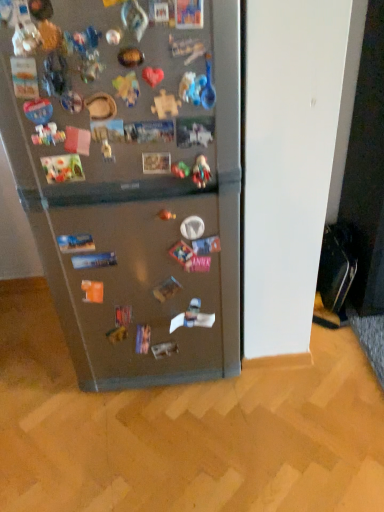
What do you see at coordinates (131, 179) in the screenshot? I see `satin metallic refrigerator at center` at bounding box center [131, 179].

At what (x,y) coordinates should I click in order to perform the action: click on satin metallic refrigerator at center. Please return your answer as a coordinate pair (x, y). Image resolution: width=384 pixels, height=512 pixels. Looking at the image, I should click on (131, 179).

The image size is (384, 512). What do you see at coordinates (201, 172) in the screenshot?
I see `plastic toy at center` at bounding box center [201, 172].

The image size is (384, 512). Find the location of `plastic toy at center`. plastic toy at center is located at coordinates (201, 172).

Find the location of `satin metallic refrigerator at center`. satin metallic refrigerator at center is located at coordinates (131, 179).

Which object is positioned more to the right, satin metallic refrigerator at center or plastic toy at center?

plastic toy at center is more to the right.

Considering the relative positions of satin metallic refrigerator at center and plastic toy at center in the image provided, is satin metallic refrigerator at center in front of plastic toy at center?

Yes, satin metallic refrigerator at center is in front of plastic toy at center.

Which is behind, point (65, 304) or point (209, 168)?

Point (65, 304)

From the image's perspective, is satin metallic refrigerator at center above or below plastic toy at center?

From the image's perspective, satin metallic refrigerator at center appears below plastic toy at center.

From a real-world perspective, is satin metallic refrigerator at center positioned under plastic toy at center based on gravity?

Indeed, from a real-world perspective, satin metallic refrigerator at center is positioned beneath plastic toy at center.

Considering the sizes of satin metallic refrigerator at center and plastic toy at center in the image, is satin metallic refrigerator at center wider or thinner than plastic toy at center?

In the image, satin metallic refrigerator at center appears to be wider than plastic toy at center.

In the scene shown: Considering the relative sizes of satin metallic refrigerator at center and plastic toy at center in the image provided, is satin metallic refrigerator at center shorter than plastic toy at center?

No, satin metallic refrigerator at center is not shorter than plastic toy at center.

Considering the sizes of satin metallic refrigerator at center and plastic toy at center in the image, is satin metallic refrigerator at center bigger or smaller than plastic toy at center?

Clearly, satin metallic refrigerator at center is larger in size than plastic toy at center.

Is satin metallic refrigerator at center positioned beyond the bounds of plastic toy at center?

Yes, satin metallic refrigerator at center is located beyond the bounds of plastic toy at center.

Is satin metallic refrigerator at center next to plastic toy at center and touching it?

They are not placed beside each other.

Could you tell me if satin metallic refrigerator at center is turned towards plastic toy at center?

Yes, satin metallic refrigerator at center is aimed at plastic toy at center.

Measure the distance between satin metallic refrigerator at center and plastic toy at center.

12.91 inches.

This screenshot has width=384, height=512. Find the location of `toy to the right of satin metallic refrigerator at center`. toy to the right of satin metallic refrigerator at center is located at coordinates (201, 172).

Between plastic toy at center and satin metallic refrigerator at center, which one appears on the right side from the viewer's perspective?

plastic toy at center.

Is plastic toy at center in front of or behind satin metallic refrigerator at center in the image?

In the image, plastic toy at center appears behind satin metallic refrigerator at center.

Is point (204, 172) positioned before point (76, 308)?

Yes, point (204, 172) is in front of point (76, 308).

From the image's perspective, is plastic toy at center above satin metallic refrigerator at center?

Yes, from the image's perspective, plastic toy at center is above satin metallic refrigerator at center.

From a real-world perspective, relative to satin metallic refrigerator at center, is plastic toy at center vertically above or below?

plastic toy at center is above satin metallic refrigerator at center.

Between plastic toy at center and satin metallic refrigerator at center, which one has smaller width?

plastic toy at center.

Which of these two, plastic toy at center or satin metallic refrigerator at center, stands shorter?

plastic toy at center is shorter.

Which of these two, plastic toy at center or satin metallic refrigerator at center, is bigger?

With larger size is satin metallic refrigerator at center.

Is satin metallic refrigerator at center completely or partially inside plastic toy at center?

No, satin metallic refrigerator at center is located outside of plastic toy at center.

Based on the photo, is plastic toy at center far away from satin metallic refrigerator at center?

No.

Is plastic toy at center positioned with its back to satin metallic refrigerator at center?

Absolutely, plastic toy at center is directed away from satin metallic refrigerator at center.

How many degrees apart are the facing directions of plastic toy at center and satin metallic refrigerator at center?

The angular difference between plastic toy at center and satin metallic refrigerator at center is 1.61 degrees.

Locate an element on the screen. The height and width of the screenshot is (512, 384). refrigerator that appears in front of the plastic toy at center is located at coordinates (131, 179).

Where is `refrigerator that appears below the plastic toy at center (from a real-world perspective)`? The width and height of the screenshot is (384, 512). refrigerator that appears below the plastic toy at center (from a real-world perspective) is located at coordinates (131, 179).

Image resolution: width=384 pixels, height=512 pixels. Find the location of `refrigerator in front of the plastic toy at center`. refrigerator in front of the plastic toy at center is located at coordinates (131, 179).